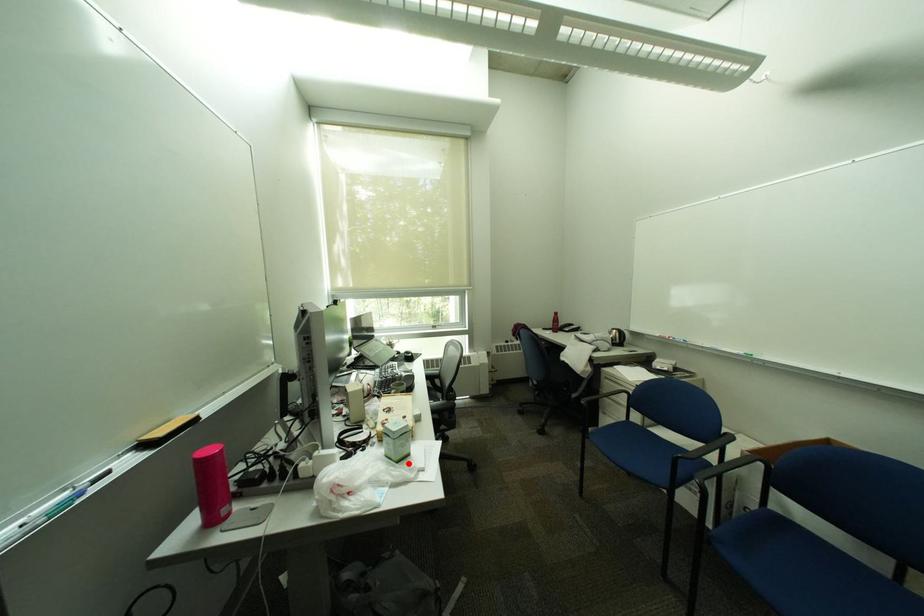
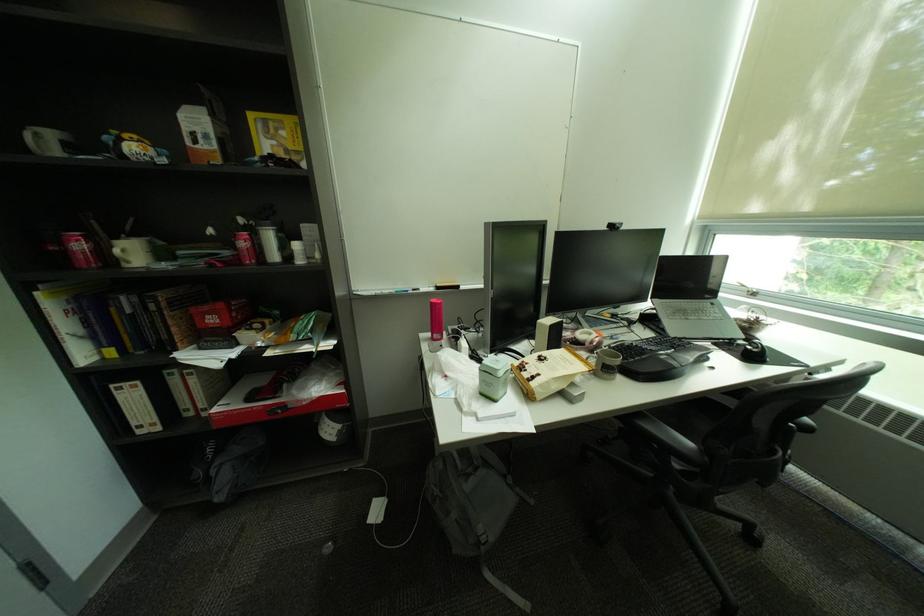
Question: A red point is marked in image1. In image2, is the corresponding 3D point closer to the camera or farther? Reply with the corresponding letter.

Choices:
 (A) The corresponding 3D point is closer.
 (B) The corresponding 3D point is farther.

Answer: (B)